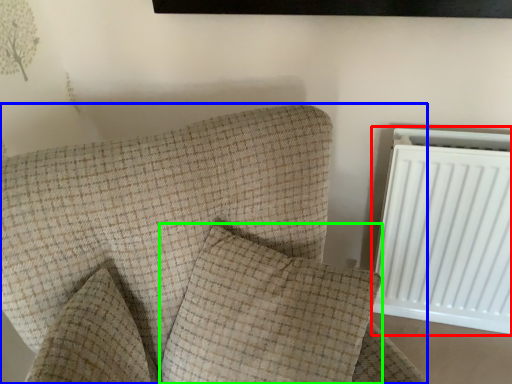
Question: Considering the real-world distances, which object is farthest from radiator (highlighted by a red box)? furniture (highlighted by a blue box) or pillow (highlighted by a green box)?

Choices:
 (A) furniture
 (B) pillow

Answer: (A)